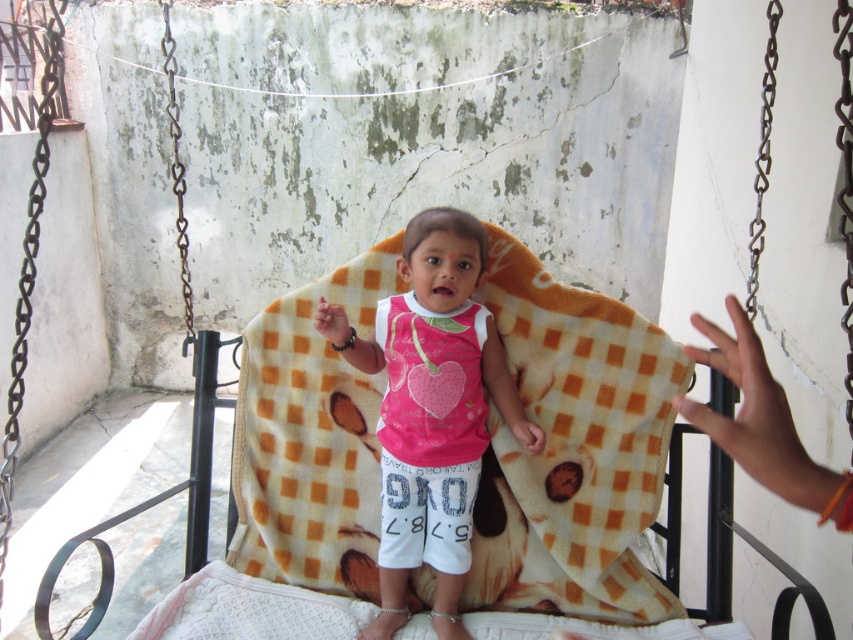
Can you confirm if orange checkered blanket at center is positioned below pink fleece shirt at center?

Yes, orange checkered blanket at center is below pink fleece shirt at center.

Is orange checkered blanket at center wider than pink fleece shirt at center?

Yes.

Between point (553, 356) and point (392, 566), which one is positioned in front?

Point (392, 566) is in front.

The image size is (853, 640). I want to click on orange checkered blanket at center, so click(x=572, y=449).